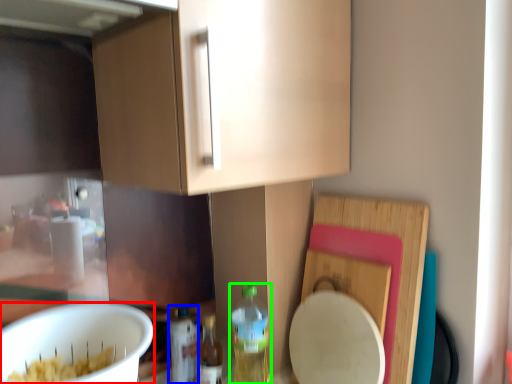
Question: Estimate the real-world distances between objects in this image. Which object is closer to mixing bowl (highlighted by a red box), bottle (highlighted by a blue box) or bottle (highlighted by a green box)?

Choices:
 (A) bottle
 (B) bottle

Answer: (A)